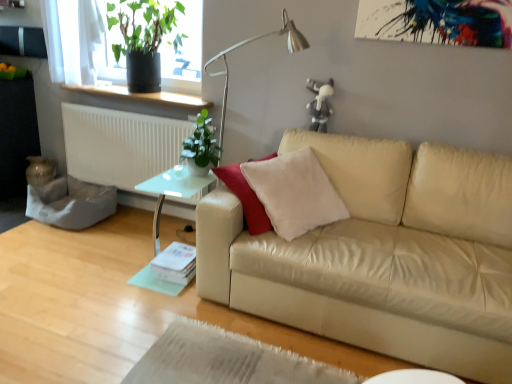
Question: Does green glossy plant at upper left, which ranks as the second houseplant in back-to-front order, have a lesser width compared to metallic silver table lamp at upper center?

Choices:
 (A) no
 (B) yes

Answer: (A)

Question: Can you confirm if green glossy plant at upper left, arranged as the 1th houseplant when ordered from the bottom, is smaller than metallic silver table lamp at upper center?

Choices:
 (A) no
 (B) yes

Answer: (B)

Question: Is green glossy plant at upper left, arranged as the 1th houseplant when ordered from the bottom, wider than metallic silver table lamp at upper center?

Choices:
 (A) yes
 (B) no

Answer: (A)

Question: From the image's perspective, does green glossy plant at upper left, acting as the second houseplant starting from the top, appear lower than metallic silver table lamp at upper center?

Choices:
 (A) no
 (B) yes

Answer: (B)

Question: In terms of height, does white plastic radiator at left look taller or shorter compared to green glossy plant at upper left, which ranks as the second houseplant in back-to-front order?

Choices:
 (A) short
 (B) tall

Answer: (B)

Question: From the image's perspective, is white plastic radiator at left positioned above or below green glossy plant at upper left, placed as the second houseplant when sorted from left to right?

Choices:
 (A) below
 (B) above

Answer: (B)

Question: From a real-world perspective, is white plastic radiator at left physically located above or below green glossy plant at upper left, arranged as the 1th houseplant when ordered from the bottom?

Choices:
 (A) below
 (B) above

Answer: (A)

Question: Considering the relative positions of white plastic radiator at left and green glossy plant at upper left, acting as the second houseplant starting from the top, in the image provided, is white plastic radiator at left to the left or to the right of green glossy plant at upper left, acting as the second houseplant starting from the top,?

Choices:
 (A) left
 (B) right

Answer: (A)

Question: Considering the relative positions of transparent glass table at lower left and green glossy plant at upper left, which ranks as the second houseplant in back-to-front order, in the image provided, is transparent glass table at lower left to the left or to the right of green glossy plant at upper left, which ranks as the second houseplant in back-to-front order,?

Choices:
 (A) right
 (B) left

Answer: (B)

Question: From a real-world perspective, is transparent glass table at lower left positioned above or below green glossy plant at upper left, arranged as the 1th houseplant when viewed from the front?

Choices:
 (A) above
 (B) below

Answer: (B)

Question: In the image, is transparent glass table at lower left positioned in front of or behind green glossy plant at upper left, arranged as the 1th houseplant when viewed from the front?

Choices:
 (A) front
 (B) behind

Answer: (A)

Question: Looking at the image, does transparent glass table at lower left seem bigger or smaller compared to green glossy plant at upper left, which ranks as the first houseplant in right-to-left order?

Choices:
 (A) small
 (B) big

Answer: (B)

Question: Looking at the image, does beige leather couch at center seem bigger or smaller compared to white plastic radiator at left?

Choices:
 (A) big
 (B) small

Answer: (A)

Question: Is point (379, 160) positioned closer to the camera than point (86, 114)?

Choices:
 (A) closer
 (B) farther

Answer: (A)